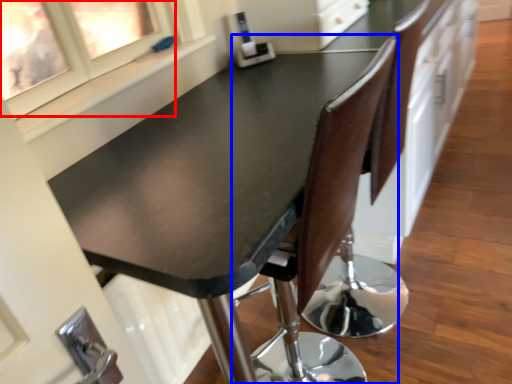
Question: Which point is further to the camera, window (highlighted by a red box) or chair (highlighted by a blue box)?

Choices:
 (A) window
 (B) chair

Answer: (B)